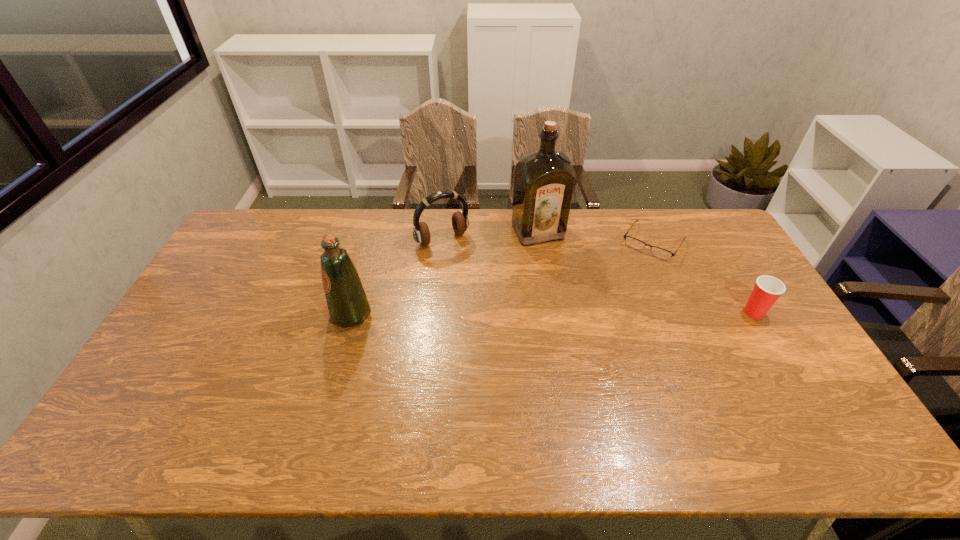
The image size is (960, 540). What are the coordinates of `vacant space on the desktop that is between the leftmost object and the fourth tallest object and is positioned on the front-facing side of the fourth object from left to right` in the screenshot? It's located at (608, 313).

At what (x,y) coordinates should I click in order to perform the action: click on vacant spot on the desktop that is between the second tallest object and the rightmost object and is positioned on the ear cup of the headset. Please return your answer as a coordinate pair (x, y). The height and width of the screenshot is (540, 960). Looking at the image, I should click on (493, 314).

Locate an element on the screen. Image resolution: width=960 pixels, height=540 pixels. free space on the desktop that is between the leftmost object and the rightmost object and is positioned on the label of the tallest object is located at coordinates (585, 313).